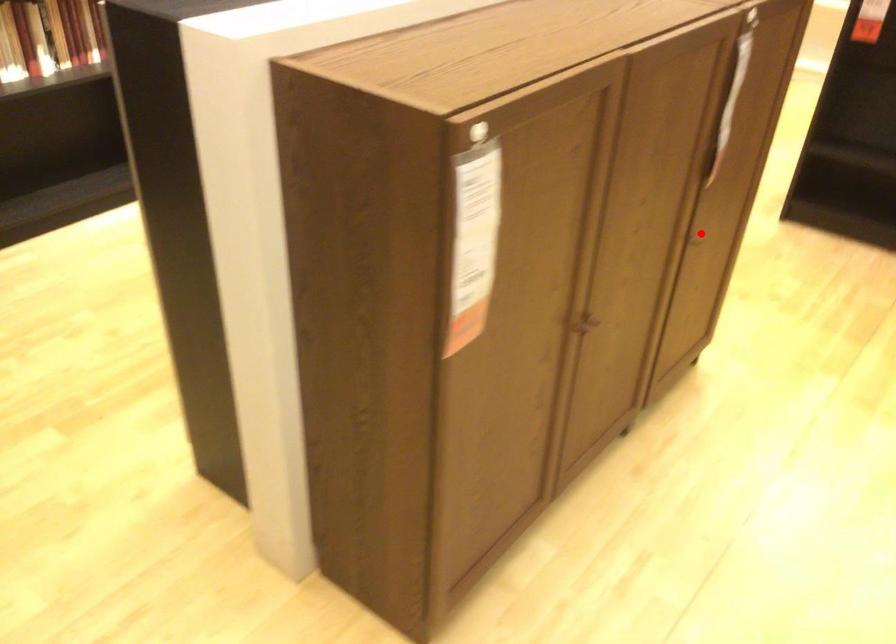
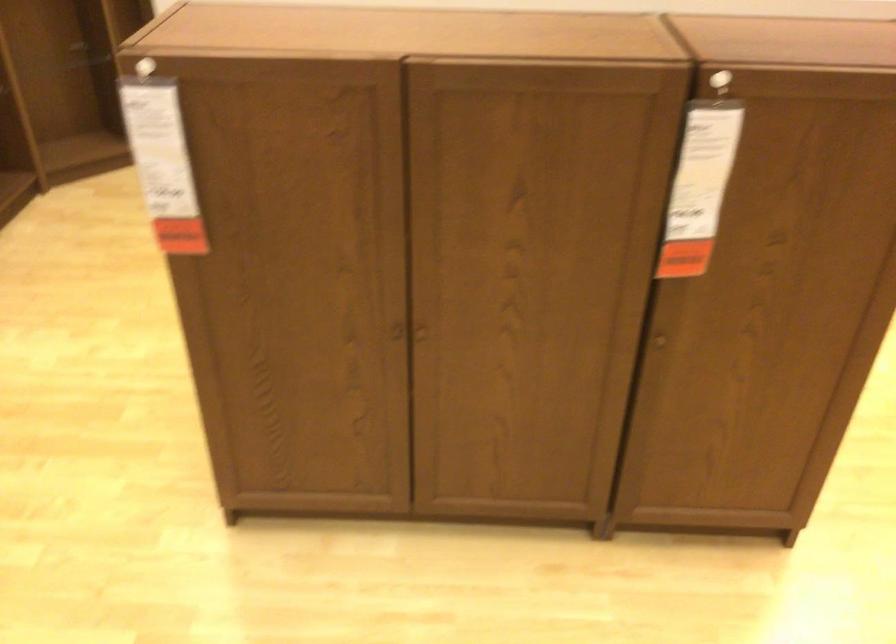
Find the pixel in the second image that matches the highlighted location in the first image.

(659, 341)